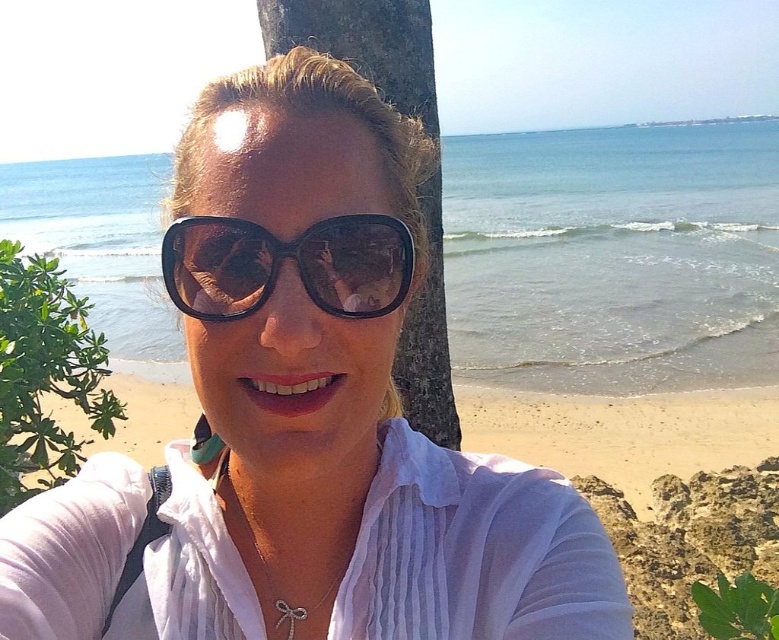
Question: Is brown textured tree trunk at center wider than sunglasses at center?

Choices:
 (A) no
 (B) yes

Answer: (B)

Question: Which point is farther to the camera?

Choices:
 (A) (58, 292)
 (B) (273, 381)

Answer: (A)

Question: Is matte black sunglasses at center closer to the viewer compared to brown textured tree trunk at center?

Choices:
 (A) yes
 (B) no

Answer: (A)

Question: Which of the following is the closest to the observer?

Choices:
 (A) (478, 573)
 (B) (298, 237)
 (C) (305, 483)

Answer: (B)

Question: Can you confirm if white cotton shirt at center is positioned to the left of sunglasses at center?

Choices:
 (A) yes
 (B) no

Answer: (B)

Question: Estimate the real-world distances between objects in this image. Which object is closer to the matte black sunglasses at center?

Choices:
 (A) white cotton shirt at center
 (B) green leafy bush at left

Answer: (A)